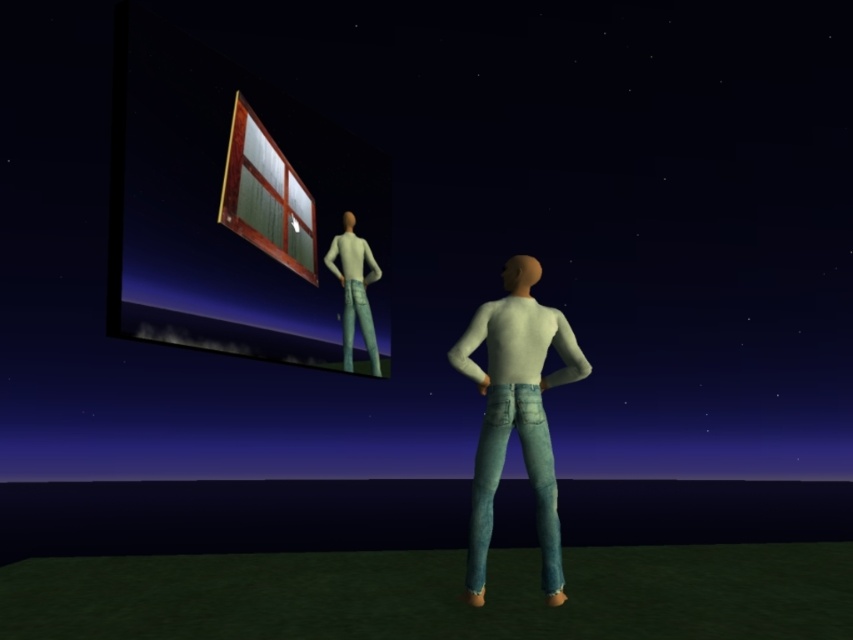
From the picture: You are an observer in the scene. You notice the light blue denim jeans at center and the wooden frame at upper center. Which object is positioned higher in the image?

The wooden frame at upper center is positioned higher than the light blue denim jeans at center.

You are an artist trying to paint the scene. You notice two objects at the upper center of the image. Which one is narrower, the wooden frame at upper center or the white matte shirt at upper center?

The wooden frame at upper center is narrower than the white matte shirt at upper center according to the description.